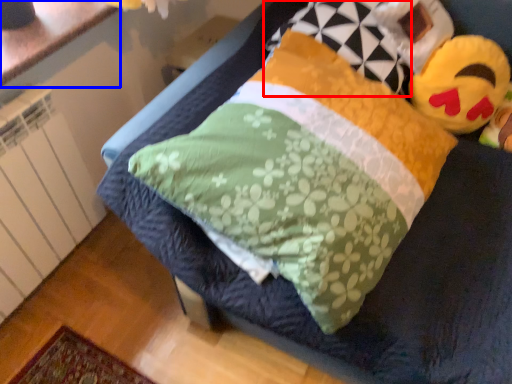
Question: Which object is further to the camera taking this photo, pillow (highlighted by a red box) or counter top (highlighted by a blue box)?

Choices:
 (A) pillow
 (B) counter top

Answer: (B)